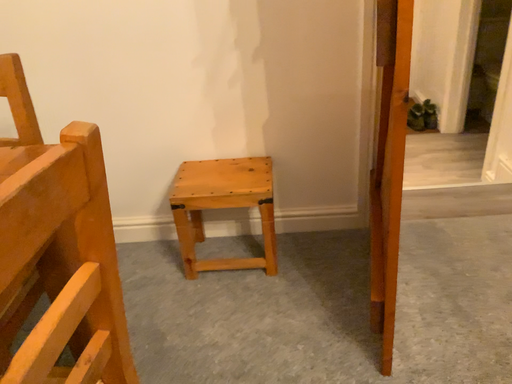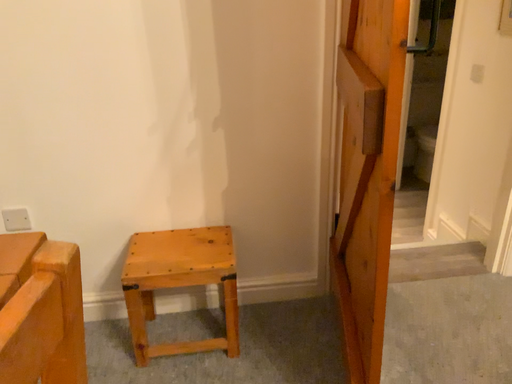
Question: How did the camera likely rotate when shooting the video?

Choices:
 (A) rotated upward
 (B) rotated downward

Answer: (A)